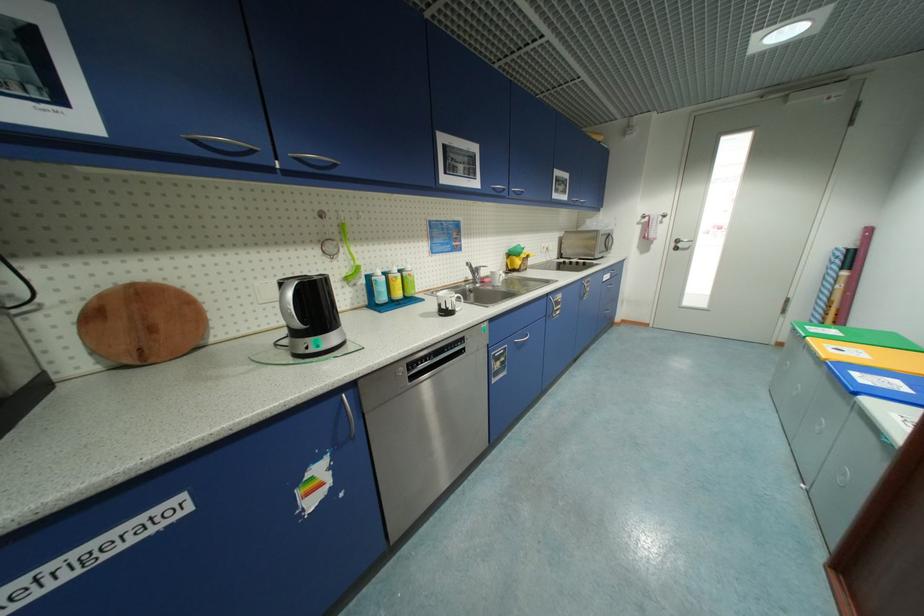
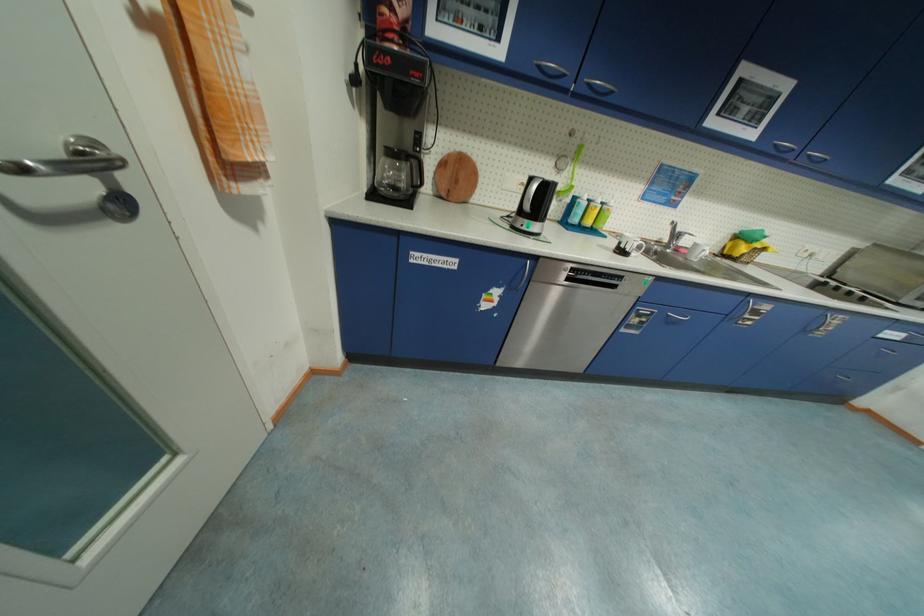
The point at (347,257) is marked in the first image. Where is the corresponding point in the second image?

(570, 175)